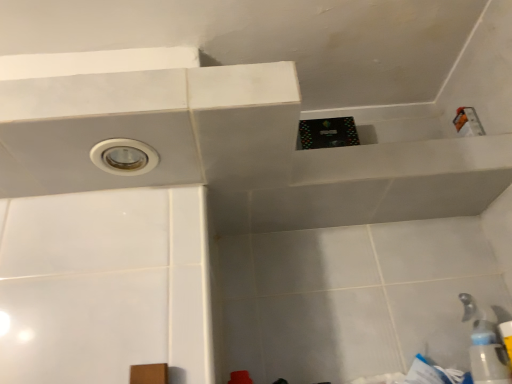
Question: Is transparent plastic bottle at lower right surrounded by white plastic faucet at lower right?

Choices:
 (A) yes
 (B) no

Answer: (B)

Question: From the image's perspective, is white plastic faucet at lower right beneath transparent plastic bottle at lower right?

Choices:
 (A) no
 (B) yes

Answer: (A)

Question: Considering the relative sizes of white plastic faucet at lower right and transparent plastic bottle at lower right in the image provided, is white plastic faucet at lower right taller than transparent plastic bottle at lower right?

Choices:
 (A) yes
 (B) no

Answer: (A)

Question: Is white plastic faucet at lower right facing towards transparent plastic bottle at lower right?

Choices:
 (A) yes
 (B) no

Answer: (B)

Question: Is white plastic faucet at lower right not within transparent plastic bottle at lower right?

Choices:
 (A) no
 (B) yes

Answer: (B)

Question: Is transparent plastic bottle at lower right bigger or smaller than white plastic hole at upper left?

Choices:
 (A) small
 (B) big

Answer: (B)

Question: In terms of height, does transparent plastic bottle at lower right look taller or shorter compared to white plastic hole at upper left?

Choices:
 (A) short
 (B) tall

Answer: (B)

Question: Relative to white plastic hole at upper left, is transparent plastic bottle at lower right in front or behind?

Choices:
 (A) front
 (B) behind

Answer: (B)

Question: Would you say transparent plastic bottle at lower right is to the left or to the right of white plastic hole at upper left in the picture?

Choices:
 (A) left
 (B) right

Answer: (B)

Question: Is point (130, 170) closer or farther from the camera than point (504, 352)?

Choices:
 (A) farther
 (B) closer

Answer: (B)

Question: Considering their positions, is white plastic hole at upper left located in front of or behind white plastic faucet at lower right?

Choices:
 (A) front
 (B) behind

Answer: (A)

Question: Is white plastic hole at upper left taller or shorter than white plastic faucet at lower right?

Choices:
 (A) tall
 (B) short

Answer: (B)

Question: Is white plastic hole at upper left to the left or to the right of white plastic faucet at lower right in the image?

Choices:
 (A) right
 (B) left

Answer: (B)

Question: From a real-world perspective, relative to white plastic hole at upper left, is white plastic faucet at lower right vertically above or below?

Choices:
 (A) above
 (B) below

Answer: (B)

Question: From the image's perspective, is white plastic faucet at lower right located above or below white plastic hole at upper left?

Choices:
 (A) above
 (B) below

Answer: (B)